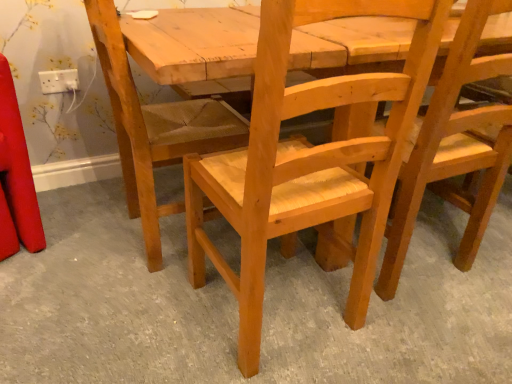
Identify the location of free space in front of natural wood chair at center, marked as the 1th chair in a left-to-right arrangement. Image resolution: width=512 pixels, height=384 pixels. (122, 311).